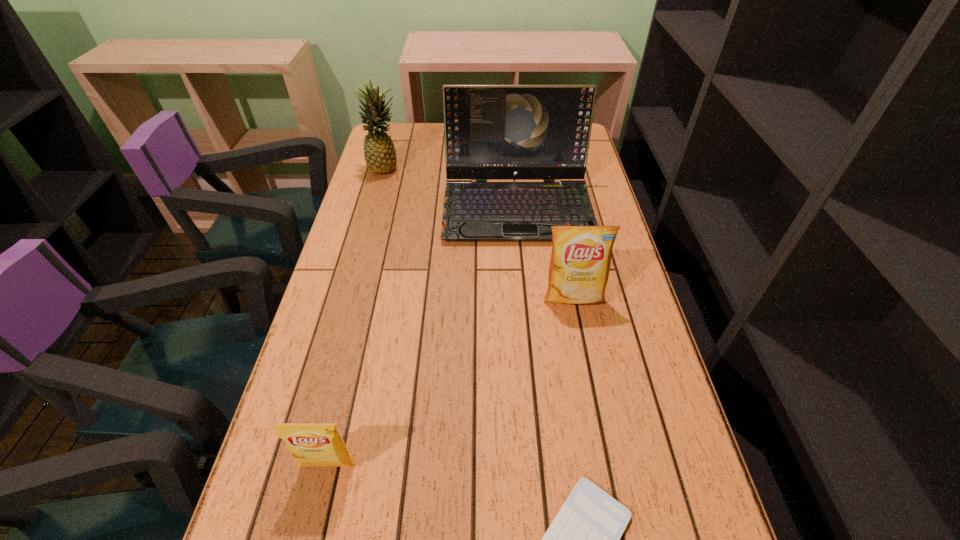
At what (x,y) coordinates should I click in order to perform the action: click on laptop computer. Please return your answer as a coordinate pair (x, y). Looking at the image, I should click on (492, 132).

Find the location of `pineapple`. pineapple is located at coordinates (380, 156).

You are a GUI agent. You are given a task and a screenshot of the screen. Output one action in this format:
    pyautogui.click(x=<x>, y=<y>)
    Task: Click on the farther crisp (potato chip)
    The width and height of the screenshot is (960, 540).
    Given the screenshot: What is the action you would take?
    pyautogui.click(x=579, y=267)

You are a GUI agent. You are given a task and a screenshot of the screen. Output one action in this format:
    pyautogui.click(x=<x>, y=<y>)
    Task: Click on the right crisp (potato chip)
    
    Given the screenshot: What is the action you would take?
    pyautogui.click(x=579, y=267)

Locate an element on the screen. This screenshot has height=540, width=960. the left crisp (potato chip) is located at coordinates (312, 444).

This screenshot has width=960, height=540. What are the coordinates of `the second shortest object` in the screenshot? It's located at (312, 444).

Locate an element on the screen. This screenshot has height=540, width=960. free space located on the screen of the laptop computer is located at coordinates (529, 329).

Locate an element on the screen. Image resolution: width=960 pixels, height=540 pixels. vacant area located on the back of the pineapple is located at coordinates (394, 137).

Locate an element on the screen. The height and width of the screenshot is (540, 960). free space located on the front-facing side of the right crisp (potato chip) is located at coordinates (588, 368).

Locate an element on the screen. This screenshot has width=960, height=540. vacant space situated 0.050m on the front of the nearer crisp (potato chip) with the logo is located at coordinates (320, 504).